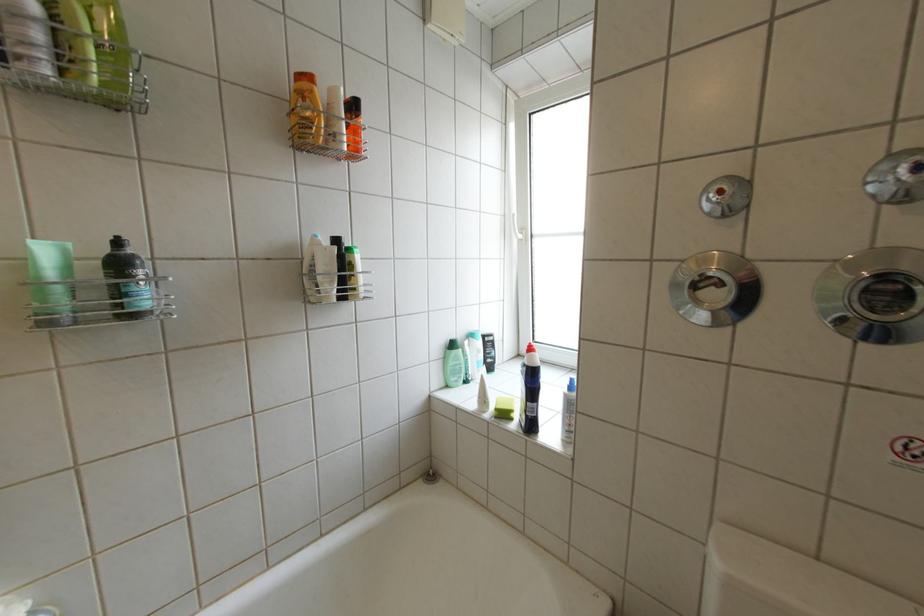
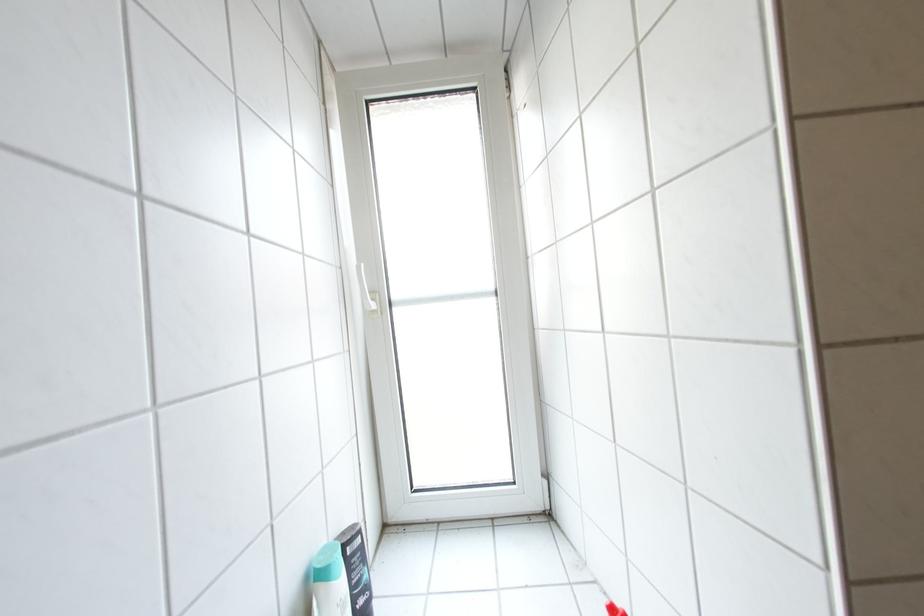
Question: How did the camera likely rotate?

Choices:
 (A) Left
 (B) Right
 (C) Up
 (D) Down

Answer: (B)